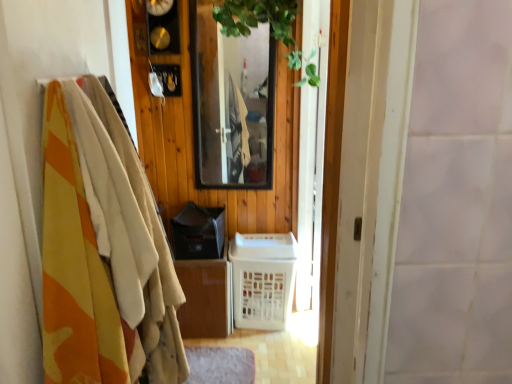
Question: In terms of size, does white plastic basket at center appear bigger or smaller than clear glass mirror at center?

Choices:
 (A) small
 (B) big

Answer: (B)

Question: Does point (275, 254) appear closer or farther from the camera than point (250, 177)?

Choices:
 (A) farther
 (B) closer

Answer: (B)

Question: Considering the real-world distances, which object is closest to the gray soft mat at lower center?

Choices:
 (A) camouflage fabric blanket at left
 (B) clear glass mirror at center
 (C) white plastic basket at center
 (D) green leafy plant at upper center

Answer: (C)

Question: Based on their relative distances, which object is nearer to the green leafy plant at upper center?

Choices:
 (A) white plastic basket at center
 (B) clear glass mirror at center
 (C) gray soft mat at lower center
 (D) camouflage fabric blanket at left

Answer: (B)